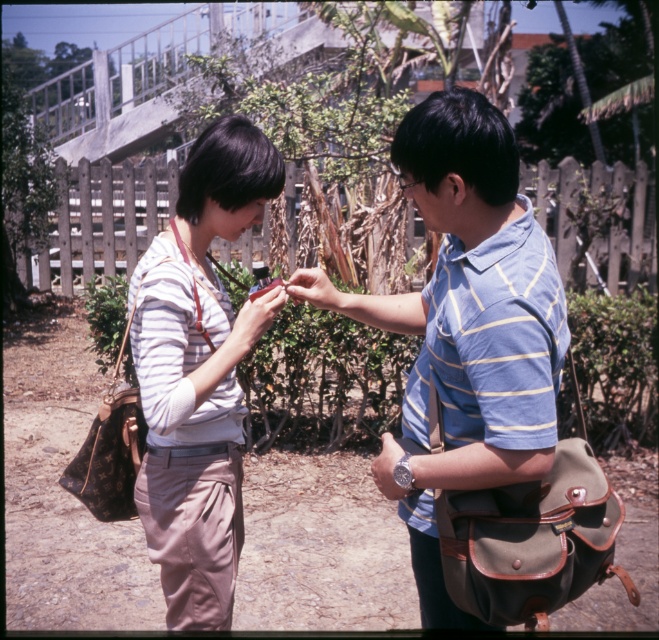
Is matte brown hand at center taller than matte brown purse at center?

Incorrect, matte brown hand at center's height is not larger of matte brown purse at center's.

Can you confirm if matte brown hand at center is bigger than matte brown purse at center?

Correct, matte brown hand at center is larger in size than matte brown purse at center.

Which is behind, point (318, 272) or point (270, 316)?

The point (318, 272) is more distant.

Find the location of a particular element. matte brown hand at center is located at coordinates (316, 291).

Between matte green bag at right and matte brown hand at center, which one has more height?

matte green bag at right

Describe the element at coordinates (469, 328) in the screenshot. The width and height of the screenshot is (659, 640). I see `matte green bag at right` at that location.

The height and width of the screenshot is (640, 659). In order to click on matte green bag at right in this screenshot , I will do `click(469, 328)`.

Locate an element on the screen. matte green bag at right is located at coordinates (469, 328).

From the picture: Can you confirm if matte brown purse at left is shorter than matte brown hand at center?

In fact, matte brown purse at left may be taller than matte brown hand at center.

Is matte brown purse at left above matte brown hand at center?

No.

Is point (198, 152) farther from camera compared to point (289, 289)?

No.

The image size is (659, 640). Find the location of `matte brown purse at left`. matte brown purse at left is located at coordinates (196, 374).